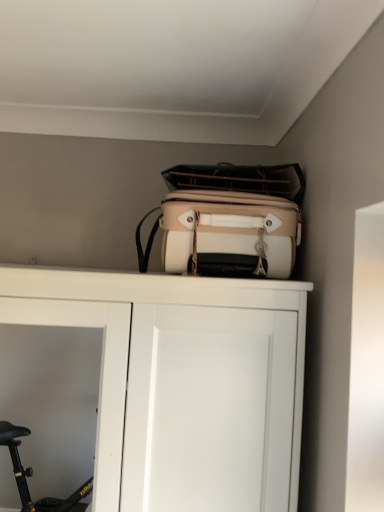
In order to face white matte cupboard at upper center, should I rotate leftwards or rightwards?

It's best to rotate left around 10.403 degrees.

Image resolution: width=384 pixels, height=512 pixels. Describe the element at coordinates (184, 383) in the screenshot. I see `white matte cupboard at upper center` at that location.

Locate an element on the screen. white matte cupboard at upper center is located at coordinates (184, 383).

The height and width of the screenshot is (512, 384). Describe the element at coordinates (225, 234) in the screenshot. I see `beige fabric suitcase at upper center` at that location.

Measure the distance between beige fabric suitcase at upper center and camera.

They are 1.04 meters apart.

Locate an element on the screen. beige fabric suitcase at upper center is located at coordinates (225, 234).

Locate an element on the screen. white matte cupboard at upper center is located at coordinates (184, 383).

Consider the image. Which is more to the right, beige fabric suitcase at upper center or white matte cupboard at upper center?

beige fabric suitcase at upper center is more to the right.

Between beige fabric suitcase at upper center and white matte cupboard at upper center, which one is positioned behind?

beige fabric suitcase at upper center is behind.

Considering the positions of point (288, 208) and point (120, 484), is point (288, 208) closer or farther from the camera than point (120, 484)?

Clearly, point (288, 208) is more distant from the camera than point (120, 484).

From the image's perspective, is beige fabric suitcase at upper center positioned above or below white matte cupboard at upper center?

beige fabric suitcase at upper center is above white matte cupboard at upper center.

From a real-world perspective, between beige fabric suitcase at upper center and white matte cupboard at upper center, who is vertically lower?

white matte cupboard at upper center, from a real-world perspective.

Can you confirm if beige fabric suitcase at upper center is wider than white matte cupboard at upper center?

Incorrect, the width of beige fabric suitcase at upper center does not surpass that of white matte cupboard at upper center.

Is beige fabric suitcase at upper center taller or shorter than white matte cupboard at upper center?

In the image, beige fabric suitcase at upper center appears to be shorter than white matte cupboard at upper center.

Is beige fabric suitcase at upper center bigger or smaller than white matte cupboard at upper center?

Considering their sizes, beige fabric suitcase at upper center takes up less space than white matte cupboard at upper center.

Could white matte cupboard at upper center be considered to be inside beige fabric suitcase at upper center?

Definitely not — white matte cupboard at upper center is not inside beige fabric suitcase at upper center.

Based on the photo, are beige fabric suitcase at upper center and white matte cupboard at upper center located far from each other?

They are positioned close to each other.

Is beige fabric suitcase at upper center facing towards white matte cupboard at upper center?

No, beige fabric suitcase at upper center is not oriented towards white matte cupboard at upper center.

How far apart are beige fabric suitcase at upper center and white matte cupboard at upper center?

They are 23.48 centimeters apart.

Where is `luggage and bags behind the white matte cupboard at upper center`? luggage and bags behind the white matte cupboard at upper center is located at coordinates (225, 234).

Is white matte cupboard at upper center to the right of beige fabric suitcase at upper center from the viewer's perspective?

Incorrect, white matte cupboard at upper center is not on the right side of beige fabric suitcase at upper center.

Consider the image. Is the depth of white matte cupboard at upper center less than that of beige fabric suitcase at upper center?

Yes, it is in front of beige fabric suitcase at upper center.

Is point (298, 428) farther from camera compared to point (140, 224)?

No, (298, 428) is closer to viewer.

From the image's perspective, is white matte cupboard at upper center positioned above or below beige fabric suitcase at upper center?

white matte cupboard at upper center is situated lower than beige fabric suitcase at upper center in the image.

From a real-world perspective, is white matte cupboard at upper center located higher than beige fabric suitcase at upper center?

Incorrect, from a real-world perspective, white matte cupboard at upper center is lower than beige fabric suitcase at upper center.

Is white matte cupboard at upper center thinner than beige fabric suitcase at upper center?

No, white matte cupboard at upper center is not thinner than beige fabric suitcase at upper center.

Is white matte cupboard at upper center shorter than beige fabric suitcase at upper center?

Incorrect, the height of white matte cupboard at upper center does not fall short of that of beige fabric suitcase at upper center.

Consider the image. Who is smaller, white matte cupboard at upper center or beige fabric suitcase at upper center?

beige fabric suitcase at upper center is smaller.

Consider the image. Is white matte cupboard at upper center spatially inside beige fabric suitcase at upper center, or outside of it?

white matte cupboard at upper center cannot be found inside beige fabric suitcase at upper center.

Would you consider white matte cupboard at upper center to be distant from beige fabric suitcase at upper center?

No, white matte cupboard at upper center is not far away from beige fabric suitcase at upper center.

Is white matte cupboard at upper center facing away from beige fabric suitcase at upper center?

No, white matte cupboard at upper center is not facing away from beige fabric suitcase at upper center.

What's the angular difference between white matte cupboard at upper center and beige fabric suitcase at upper center's facing directions?

The facing directions of white matte cupboard at upper center and beige fabric suitcase at upper center are 0.000132 degrees apart.

How distant is white matte cupboard at upper center from beige fabric suitcase at upper center?

white matte cupboard at upper center is 9.25 inches from beige fabric suitcase at upper center.

The height and width of the screenshot is (512, 384). I want to click on cupboard located on the left of beige fabric suitcase at upper center, so click(184, 383).

Find the location of `cupboard to the left of beige fabric suitcase at upper center`. cupboard to the left of beige fabric suitcase at upper center is located at coordinates (184, 383).

Identify the location of cupboard lying in front of the beige fabric suitcase at upper center. The image size is (384, 512). (184, 383).